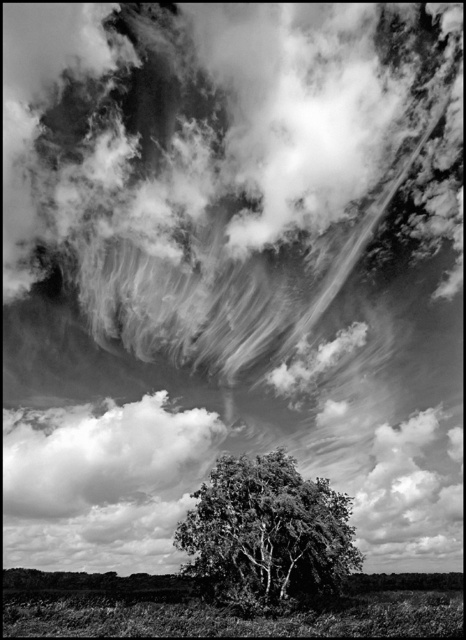
You are a photographer analyzing the composition of this black and white photo. You notice the green leafy tree at center and the cloudy white cloud at lower center. Which object is positioned lower in the frame?

The green leafy tree at center is positioned lower in the frame than the cloudy white cloud at lower center.

You are analyzing the black and white photograph and want to determine which of the two points, point (259, 572) or point (144, 486), is nearer to you. Based on the scene, can you identify which point is closer?

Point (259, 572) is closer to the viewer than point (144, 486).